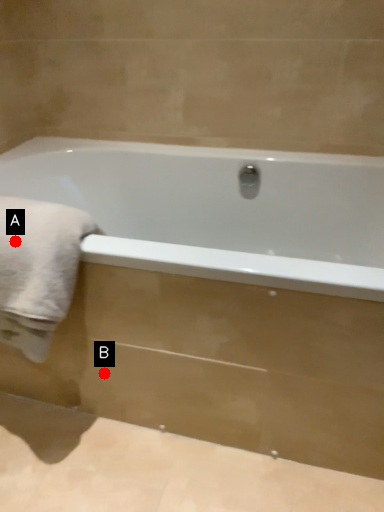
Question: Two points are circled on the image, labeled by A and B beside each circle. Which point is further to the camera?

Choices:
 (A) A is further
 (B) B is further

Answer: (B)